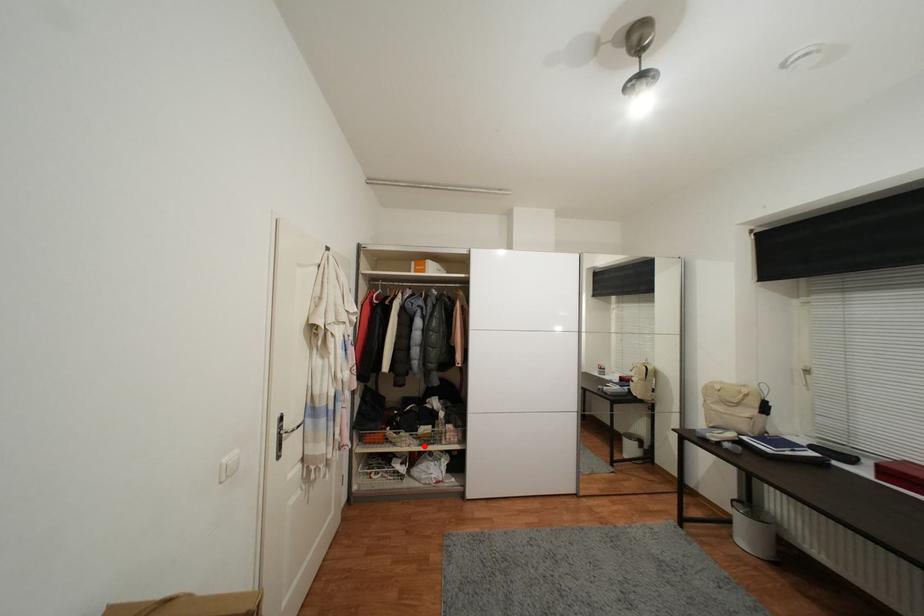
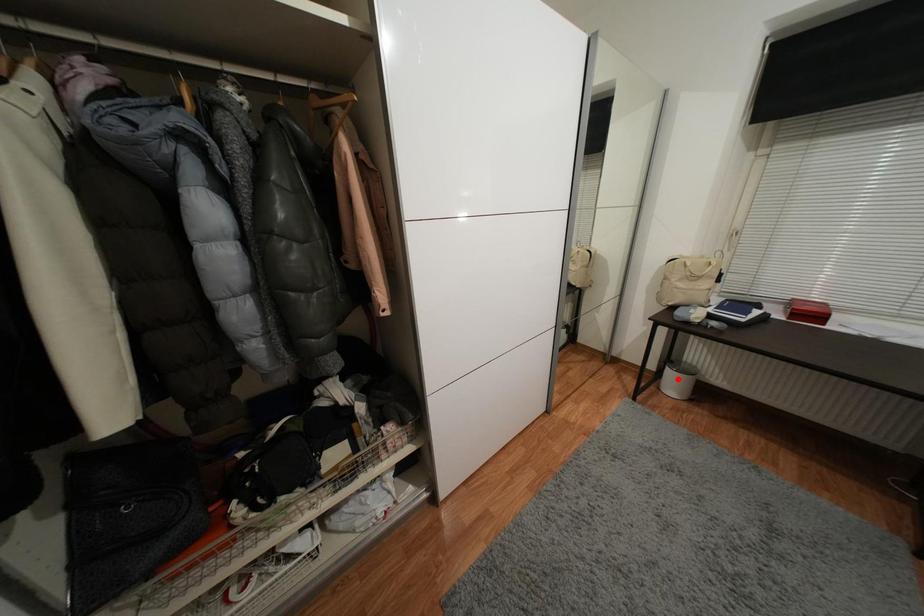
I am providing you with two images of the same scene from different viewpoints. A red point is marked on the first image and another point is marked on the second image. Is the marked point in image1 the same physical position as the marked point in image2?

No